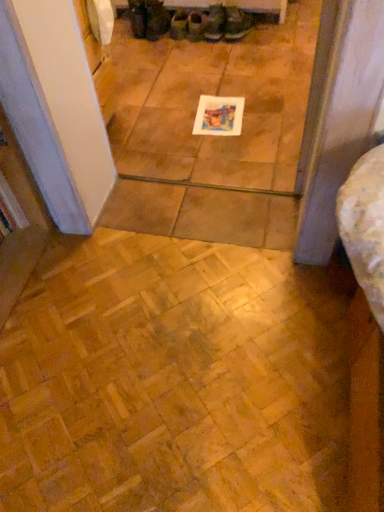
At what (x,y) coordinates should I click in order to perform the action: click on vacant area that lies to the right of white paper at center. Please return your answer as a coordinate pair (x, y). Image resolution: width=384 pixels, height=512 pixels. Looking at the image, I should click on (271, 113).